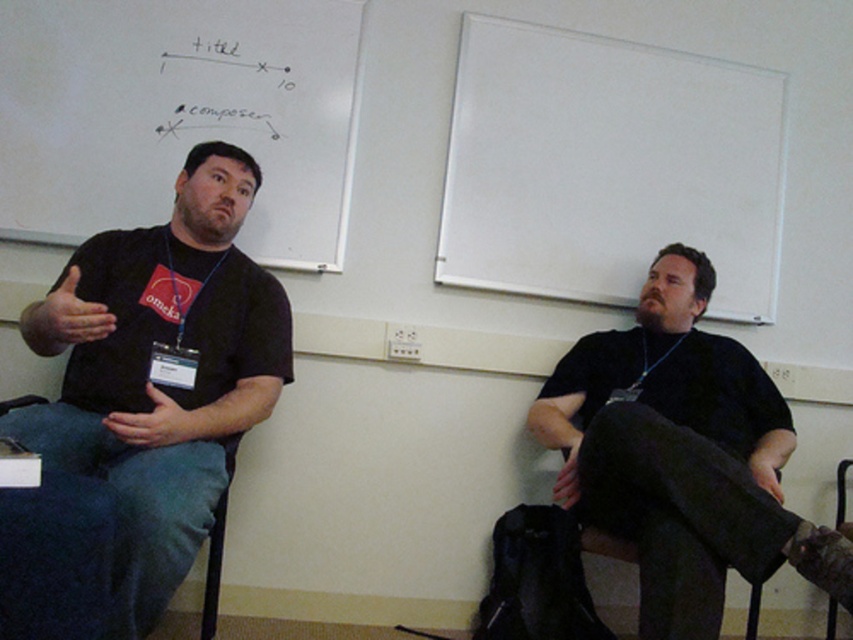
You are an attendee at an event and need to take notes. You see the white matte board at upper center and the white matte whiteboard at upper left. Which one is lower in the image?

The white matte board at upper center is located below the white matte whiteboard at upper left, so it is lower in the image.